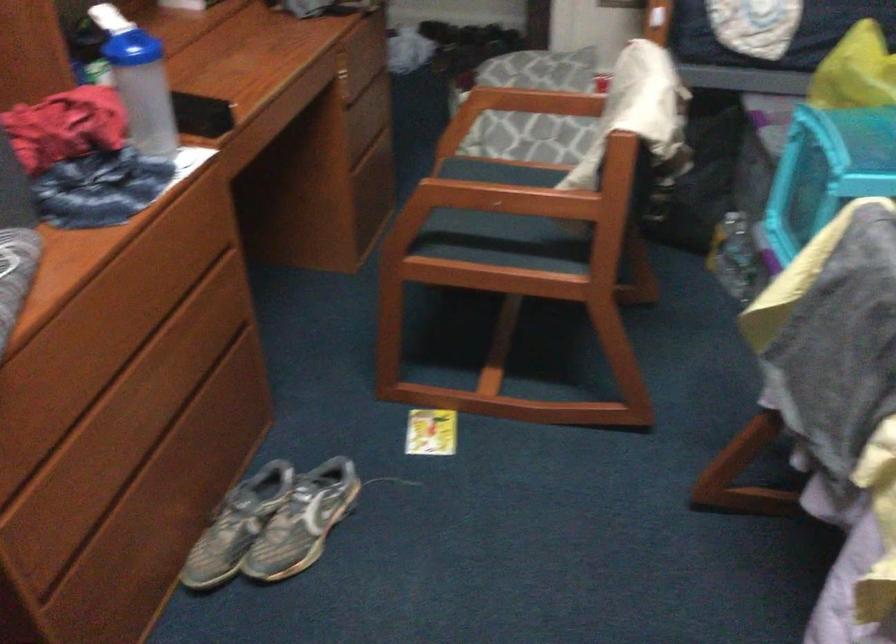
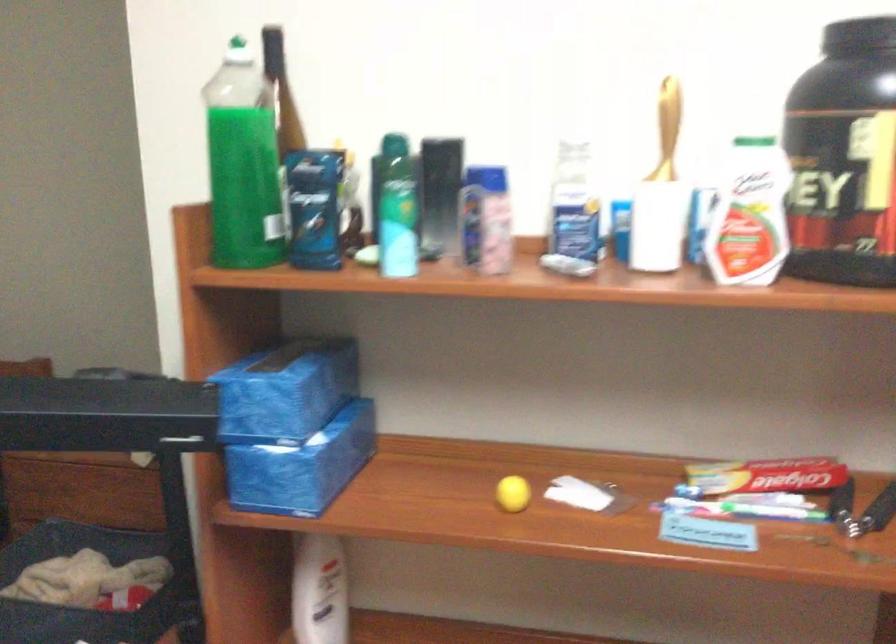
Question: Based on the continuous images, in which direction is the camera rotating? Reply with the corresponding letter.

Choices:
 (A) Left
 (B) Right
 (C) Up
 (D) Down

Answer: (B)